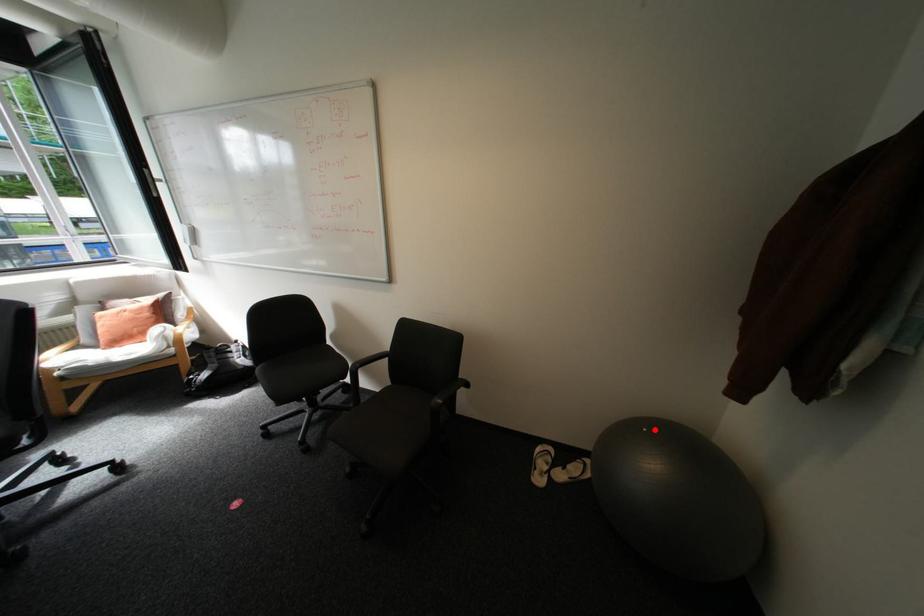
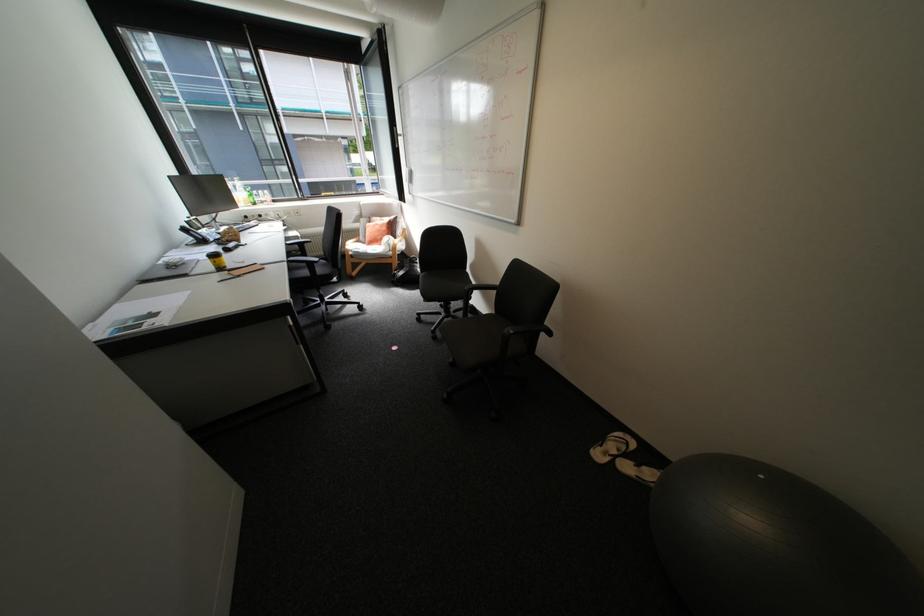
Where in the second image is the point corresponding to the highlighted location from the first image?

(772, 477)